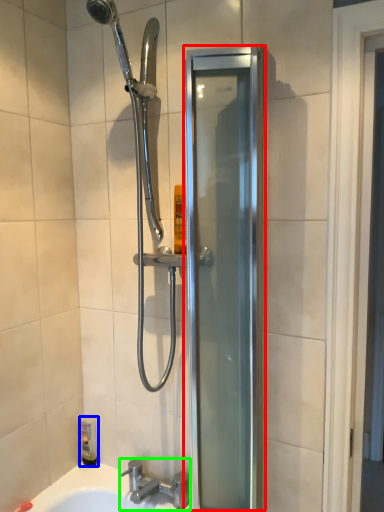
Question: Which object is the closest to the screen door (highlighted by a red box)? Choose among these: toiletry (highlighted by a blue box) or tap (highlighted by a green box).

Choices:
 (A) toiletry
 (B) tap

Answer: (B)